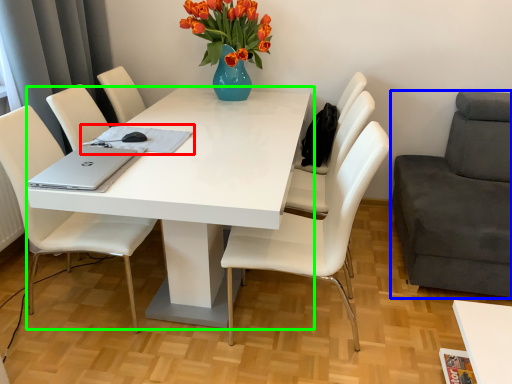
Question: Which object is the closest to the notepad (highlighted by a red box)? Choose among these: chair (highlighted by a blue box) or table (highlighted by a green box).

Choices:
 (A) chair
 (B) table

Answer: (B)